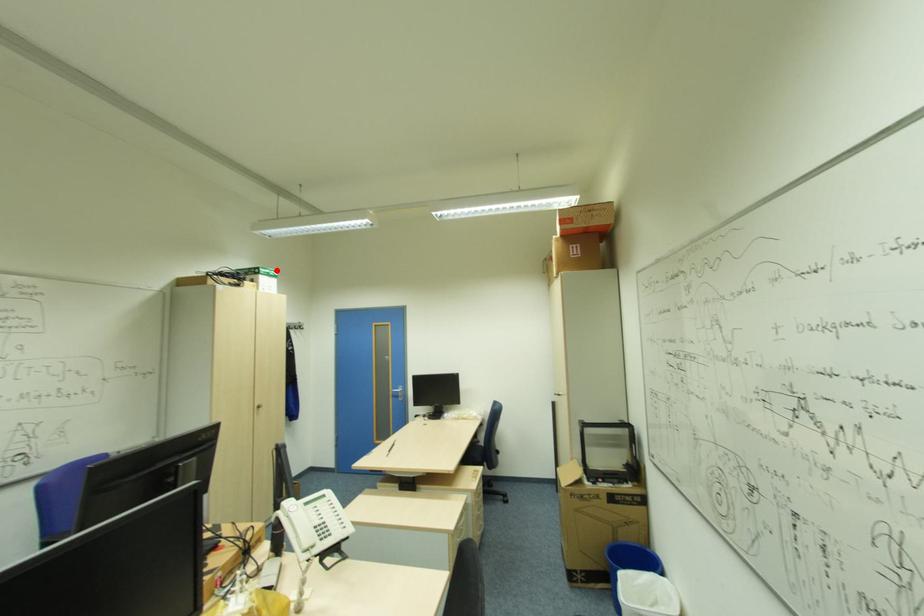
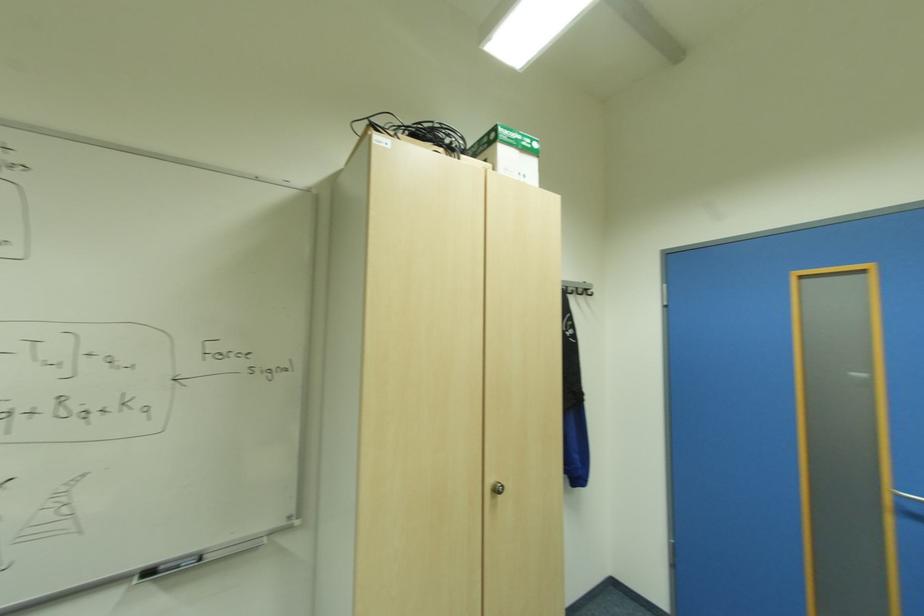
Locate, in the second image, the point that corresponds to the highlighted location in the first image.

(533, 140)